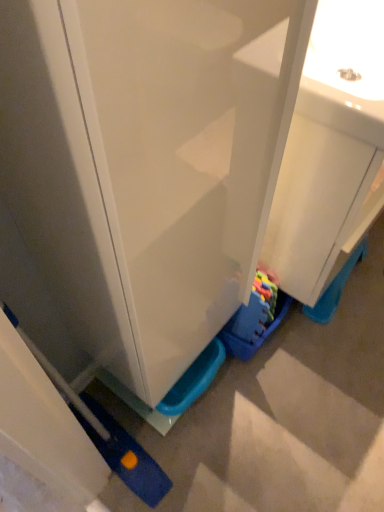
Question: Can you confirm if matte white cabinet at center is smaller than white glossy sink at center?

Choices:
 (A) no
 (B) yes

Answer: (B)

Question: Can you confirm if matte white cabinet at center is thinner than white glossy sink at center?

Choices:
 (A) yes
 (B) no

Answer: (A)

Question: Is matte white cabinet at center looking in the opposite direction of white glossy sink at center?

Choices:
 (A) no
 (B) yes

Answer: (A)

Question: Does matte white cabinet at center have a lesser height compared to white glossy sink at center?

Choices:
 (A) yes
 (B) no

Answer: (B)

Question: From the image's perspective, is matte white cabinet at center located above white glossy sink at center?

Choices:
 (A) yes
 (B) no

Answer: (B)

Question: Relative to rubberized plastic toy at lower center, is white glossy sink at center in front or behind?

Choices:
 (A) behind
 (B) front

Answer: (B)

Question: Is white glossy sink at center inside the boundaries of rubberized plastic toy at lower center, or outside?

Choices:
 (A) inside
 (B) outside

Answer: (B)

Question: Considering the positions of point (375, 154) and point (225, 326), is point (375, 154) closer or farther from the camera than point (225, 326)?

Choices:
 (A) farther
 (B) closer

Answer: (B)

Question: Is white glossy sink at center wider or thinner than rubberized plastic toy at lower center?

Choices:
 (A) thin
 (B) wide

Answer: (B)

Question: Looking at the image, does rubberized plastic toy at lower center seem bigger or smaller compared to white glossy sink at center?

Choices:
 (A) big
 (B) small

Answer: (B)

Question: Considering the positions of rubberized plastic toy at lower center and white glossy sink at center in the image, is rubberized plastic toy at lower center wider or thinner than white glossy sink at center?

Choices:
 (A) wide
 (B) thin

Answer: (B)

Question: Would you say rubberized plastic toy at lower center is inside or outside white glossy sink at center?

Choices:
 (A) inside
 (B) outside

Answer: (B)

Question: Relative to white glossy sink at center, is rubberized plastic toy at lower center in front or behind?

Choices:
 (A) behind
 (B) front

Answer: (A)

Question: Is matte white cabinet at center inside the boundaries of white glossy sink at center, or outside?

Choices:
 (A) inside
 (B) outside

Answer: (B)

Question: Looking at the image, does matte white cabinet at center seem bigger or smaller compared to white glossy sink at center?

Choices:
 (A) big
 (B) small

Answer: (B)